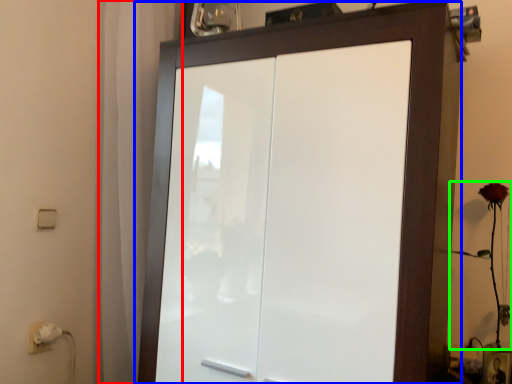
Question: Considering the real-world distances, which object is closest to curtain (highlighted by a red box)? cupboard (highlighted by a blue box) or flower (highlighted by a green box).

Choices:
 (A) cupboard
 (B) flower

Answer: (A)